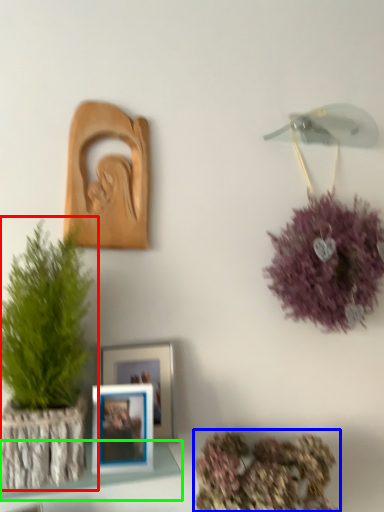
Question: Estimate the real-world distances between objects in this image. Which object is closer to houseplant (highlighted by a red box), floral arrangement (highlighted by a blue box) or shelf (highlighted by a green box)?

Choices:
 (A) floral arrangement
 (B) shelf

Answer: (B)